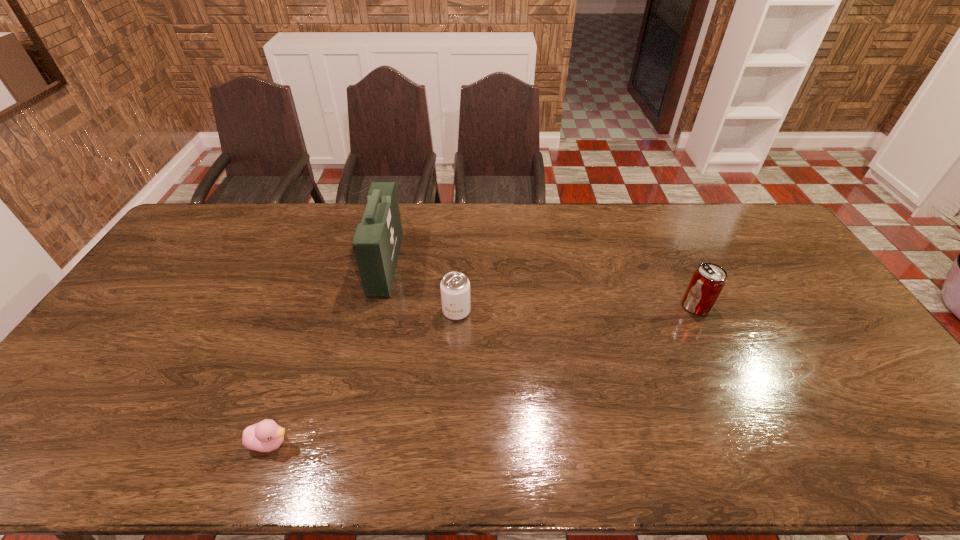
The height and width of the screenshot is (540, 960). Identify the location of the tallest object. (377, 240).

Where is `the first-aid kit`? The height and width of the screenshot is (540, 960). the first-aid kit is located at coordinates (377, 240).

The height and width of the screenshot is (540, 960). Find the location of `the right soda can`. the right soda can is located at coordinates [707, 282].

This screenshot has height=540, width=960. Find the location of `the third object from left to right`. the third object from left to right is located at coordinates (455, 287).

The width and height of the screenshot is (960, 540). Find the location of `the leftmost object`. the leftmost object is located at coordinates (265, 436).

Where is `the nearest object`? the nearest object is located at coordinates (265, 436).

Locate an element on the screen. vacant region located on the front-facing side of the tallest object is located at coordinates (514, 264).

You are a GUI agent. You are given a task and a screenshot of the screen. Output one action in this format:
    pyautogui.click(x=<x>, y=<y>)
    Task: Click on the free space located 0.230m on the right of the rightmost object
    Image resolution: width=960 pixels, height=540 pixels.
    Given the screenshot: What is the action you would take?
    pyautogui.click(x=786, y=306)

Where is `vacant area situated on the right of the second object from right to left`? Image resolution: width=960 pixels, height=540 pixels. vacant area situated on the right of the second object from right to left is located at coordinates (544, 311).

Identify the location of vacant position located 0.310m on the front-facing side of the shortest object. (427, 443).